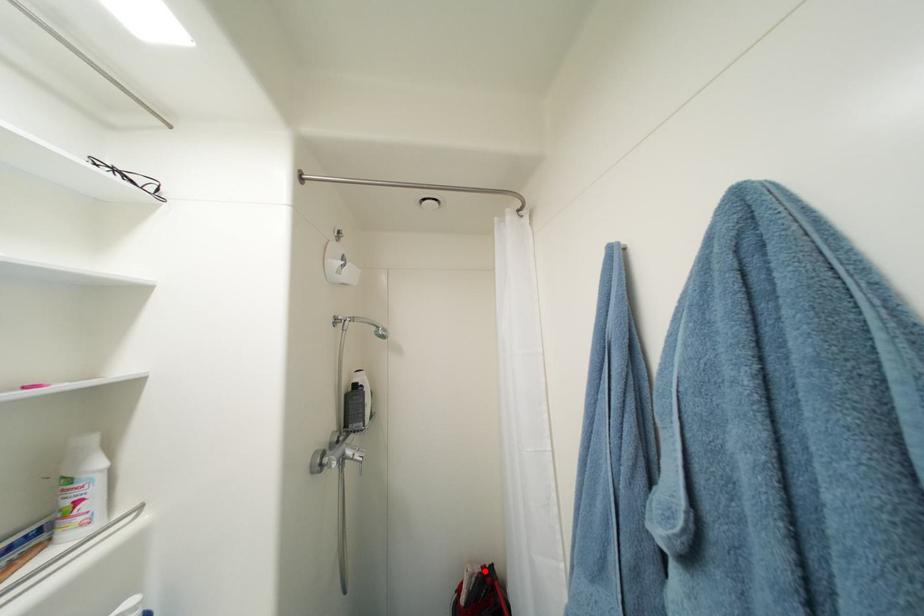
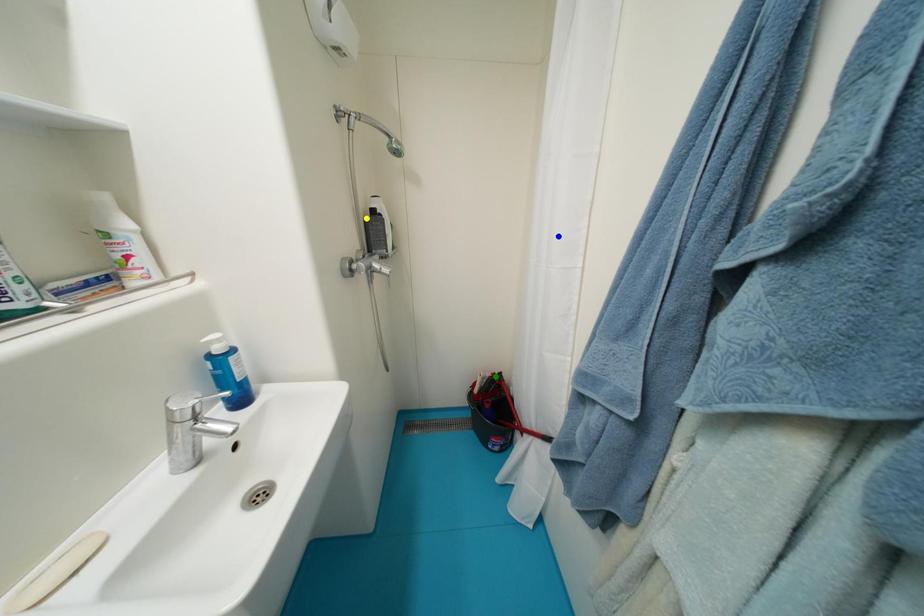
Question: I am providing you with two images of the same scene from different viewpoints. A red point is marked on the first image. You are given multiple points on the second image. Which spot in image 2 lines up with the point in image 1?

Choices:
 (A) blue point
 (B) yellow point
 (C) green point

Answer: (C)